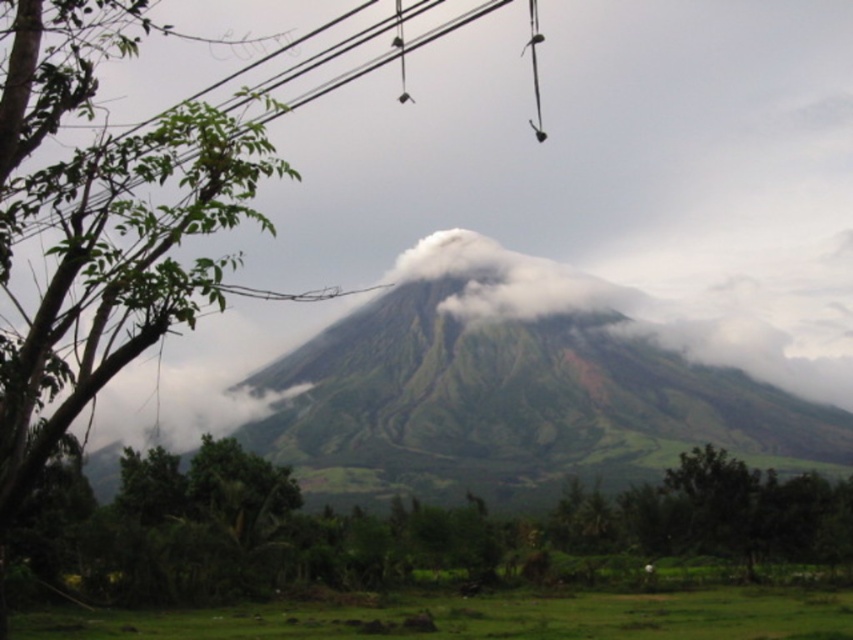
The height and width of the screenshot is (640, 853). What are the coordinates of `green grassy mountain at center` in the screenshot? It's located at (627, 310).

Who is lower down, green grassy mountain at center or black wire at upper center?

green grassy mountain at center

The height and width of the screenshot is (640, 853). I want to click on green grassy mountain at center, so click(627, 310).

Is point (146, 1) closer to camera compared to point (479, 12)?

That is True.

Is green leafy tree at left to the right of black wire at upper center from the viewer's perspective?

Incorrect, green leafy tree at left is not on the right side of black wire at upper center.

Who is more distant from viewer, (180, 278) or (370, 61)?

The point (370, 61) is behind.

Where is `green leafy tree at left`? This screenshot has height=640, width=853. green leafy tree at left is located at coordinates (102, 227).

Is point (119, 358) positioned before point (735, 333)?

Yes, it is.

Is green leafy tree at left above green grassy mountain at center?

Correct, green leafy tree at left is located above green grassy mountain at center.

Find the location of `green leafy tree at left`. green leafy tree at left is located at coordinates (102, 227).